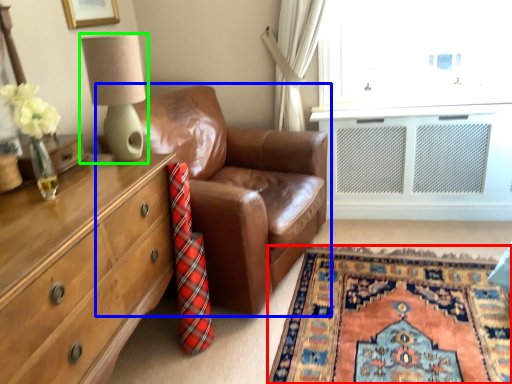
Question: Which object is positioned farthest from plain (highlighted by a red box)? Select from studio couch (highlighted by a blue box) and table lamp (highlighted by a green box).

Choices:
 (A) studio couch
 (B) table lamp

Answer: (B)